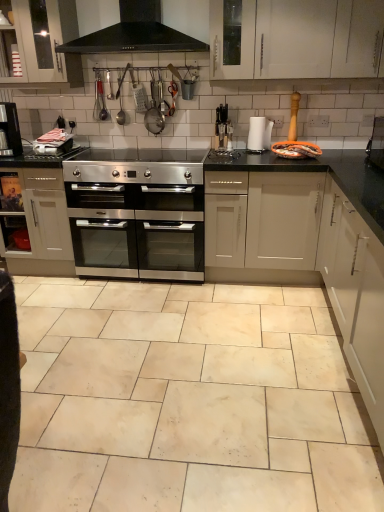
Locate an element on the screen. vacant area in front of black granite countertop at center is located at coordinates (256, 342).